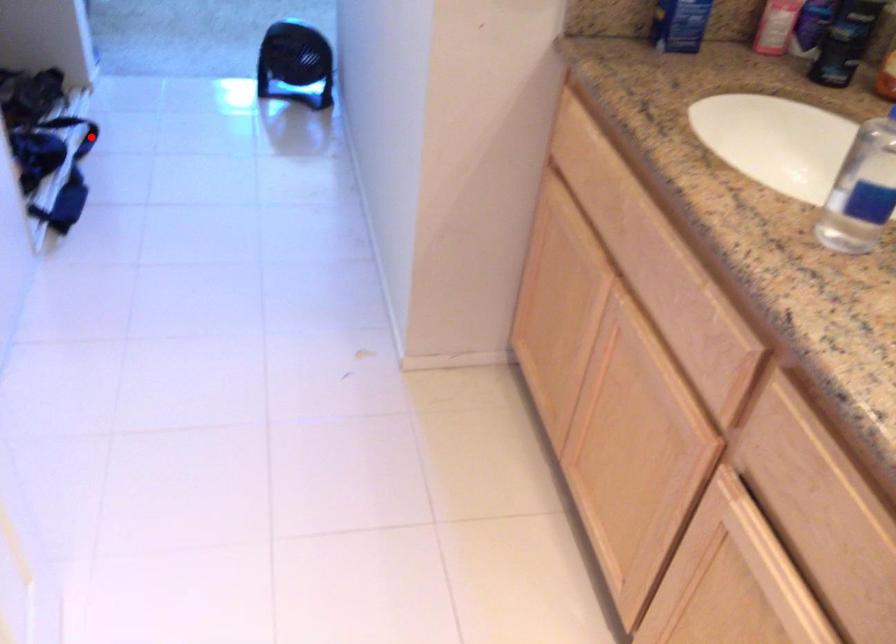
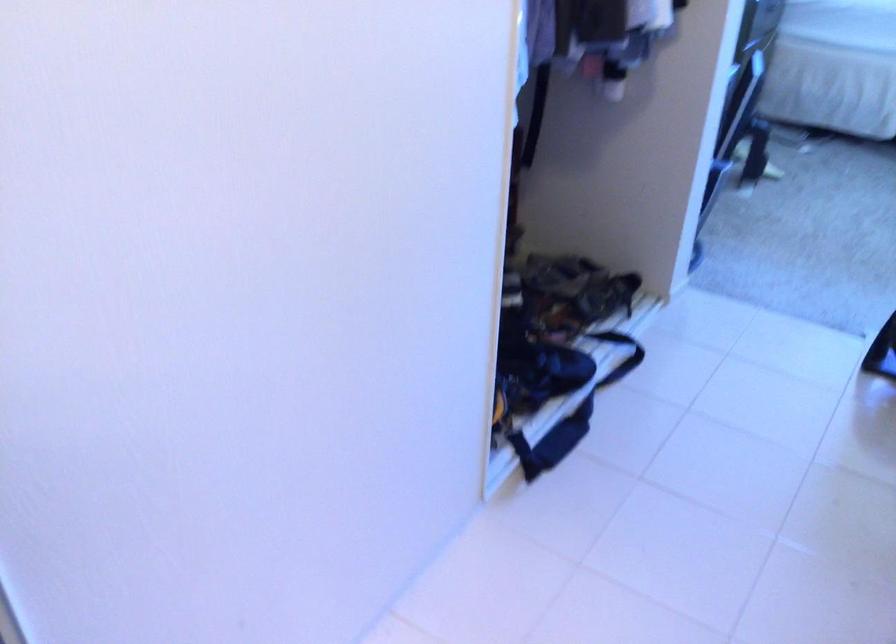
Where in the second image is the point corresponding to the highlighted location from the first image?

(621, 355)